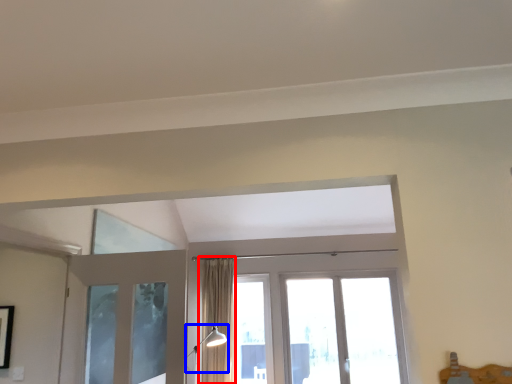
Question: Which of the following is the closest to the observer, curtain (highlighted by a red box) or light fixture (highlighted by a blue box)?

Choices:
 (A) curtain
 (B) light fixture

Answer: (B)